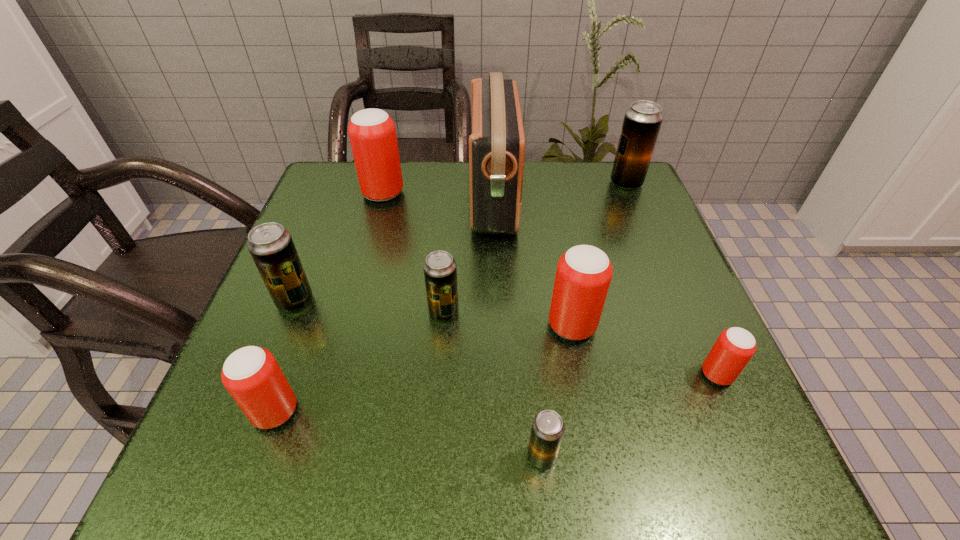
This screenshot has width=960, height=540. Find the location of `free space located 0.180m on the right of the third nearest red beer can`. free space located 0.180m on the right of the third nearest red beer can is located at coordinates (697, 326).

Locate an element on the screen. The width and height of the screenshot is (960, 540). vacant region located on the front of the leftmost black beer can is located at coordinates (276, 352).

Find the location of a particular element. The image size is (960, 540). free region located 0.050m on the back of the fourth object from left to right is located at coordinates (446, 282).

Find the location of a particular element. The width and height of the screenshot is (960, 540). vacant space located 0.370m on the back of the third biggest red beer can is located at coordinates (337, 239).

This screenshot has width=960, height=540. Find the location of `free spot located on the left of the smallest red beer can`. free spot located on the left of the smallest red beer can is located at coordinates (553, 374).

In order to click on vacant region located 0.090m on the right of the nearest beer can in this screenshot , I will do (620, 456).

Locate an element on the screen. The width and height of the screenshot is (960, 540). radio receiver present at the far edge is located at coordinates (497, 143).

The image size is (960, 540). I want to click on object at the far left corner, so 372,133.

You are a GUI agent. You are given a task and a screenshot of the screen. Output one action in this format:
    pyautogui.click(x=<x>, y=<y>)
    Task: Click on the object that is positioned at the near left corner
    
    Given the screenshot: What is the action you would take?
    pyautogui.click(x=251, y=374)

At what (x,y) coordinates should I click in order to perform the action: click on object that is positioned at the far right corner. Please return your answer as a coordinate pair (x, y). This screenshot has height=540, width=960. Looking at the image, I should click on (642, 121).